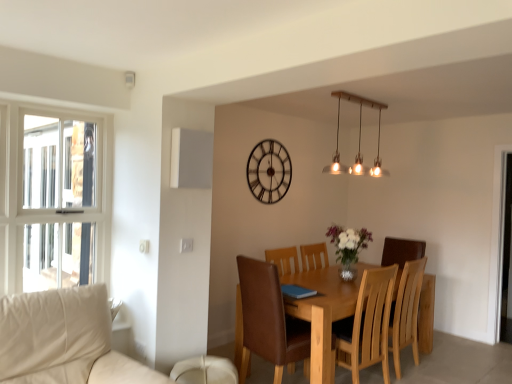
Question: From the image's perspective, would you say light brown wood chair at center, the first chair from the back, is positioned over light brown wooden table at center?

Choices:
 (A) no
 (B) yes

Answer: (B)

Question: Is light brown wood chair at center, the first chair from the back, positioned with its back to light brown wooden table at center?

Choices:
 (A) yes
 (B) no

Answer: (A)

Question: From the image's perspective, would you say light brown wood chair at center, which is the 2th chair from left to right, is shown under light brown wooden table at center?

Choices:
 (A) no
 (B) yes

Answer: (A)

Question: Considering the relative sizes of light brown wood chair at center, which is the 2th chair from left to right, and light brown wooden table at center in the image provided, is light brown wood chair at center, which is the 2th chair from left to right, wider than light brown wooden table at center?

Choices:
 (A) yes
 (B) no

Answer: (B)

Question: From a real-world perspective, is light brown wood chair at center, the 1th chair when ordered from right to left, under light brown wooden table at center?

Choices:
 (A) no
 (B) yes

Answer: (A)

Question: Is light brown wood chair at center, the second chair when ordered from front to back, outside of light brown wooden table at center?

Choices:
 (A) no
 (B) yes

Answer: (A)

Question: Is brown leather chair at center, which is counted as the second chair, starting from the right, looking in the opposite direction of metallic clock at upper center?

Choices:
 (A) yes
 (B) no

Answer: (B)

Question: Would you say brown leather chair at center, which is counted as the second chair, starting from the right, contains metallic clock at upper center?

Choices:
 (A) no
 (B) yes

Answer: (A)

Question: From a real-world perspective, does brown leather chair at center, acting as the first chair starting from the front, stand above metallic clock at upper center?

Choices:
 (A) yes
 (B) no

Answer: (B)

Question: Is brown leather chair at center, acting as the first chair starting from the front, at the left side of metallic clock at upper center?

Choices:
 (A) no
 (B) yes

Answer: (A)

Question: From the image's perspective, is brown leather chair at center, the second chair when ordered from back to front, located above metallic clock at upper center?

Choices:
 (A) no
 (B) yes

Answer: (A)

Question: Does brown leather chair at center, acting as the first chair starting from the front, have a lesser width compared to metallic clock at upper center?

Choices:
 (A) no
 (B) yes

Answer: (A)

Question: Are metallic clock at upper center and light brown wooden table at center far apart?

Choices:
 (A) yes
 (B) no

Answer: (A)